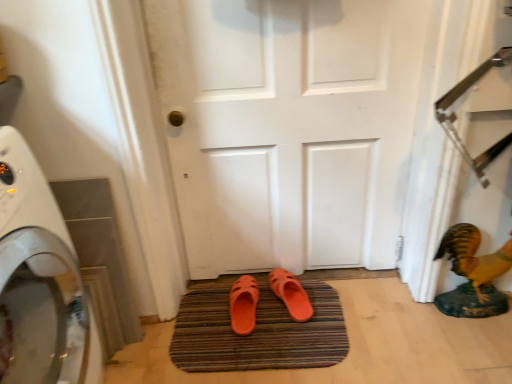
Describe the element at coordinates (243, 305) in the screenshot. I see `orange rubber slipper at center, the 1th footwear from the left` at that location.

I want to click on shiny gold statue at lower right, so [x=474, y=258].

Find the location of a particular element. The width and height of the screenshot is (512, 384). orange rubber slipper at center, the 2th footwear positioned from the left is located at coordinates (291, 294).

Is point (257, 255) closer or farther from the camera than point (504, 250)?

Point (257, 255) is positioned farther from the camera compared to point (504, 250).

Considering the positions of objects white matte door at center and shiny gold statue at lower right in the image provided, who is more to the left, white matte door at center or shiny gold statue at lower right?

From the viewer's perspective, white matte door at center appears more on the left side.

Find the location of `door in front of the shiny gold statue at lower right`. door in front of the shiny gold statue at lower right is located at coordinates (289, 127).

From a real-world perspective, is white matte door at center physically located above or below shiny gold statue at lower right?

From a real-world perspective, white matte door at center is physically above shiny gold statue at lower right.

Could you tell me if orange rubber slipper at center, the first footwear from the right, is facing orange rubber slipper at center, the 1th footwear from the left?

No.

Can you confirm if orange rubber slipper at center, the first footwear from the right, is thinner than orange rubber slipper at center, the 2th footwear from the right?

Yes, orange rubber slipper at center, the first footwear from the right, is thinner than orange rubber slipper at center, the 2th footwear from the right.

Is orange rubber slipper at center, the first footwear from the right, further to the viewer compared to orange rubber slipper at center, the 2th footwear from the right?

Yes, the depth of orange rubber slipper at center, the first footwear from the right, is greater than that of orange rubber slipper at center, the 2th footwear from the right.

From the image's perspective, is white matte door at center located above orange rubber bath mat at center?

Yes, from the image's perspective, white matte door at center is above orange rubber bath mat at center.

Does point (183, 49) come closer to viewer compared to point (186, 352)?

Yes.

Is orange rubber bath mat at center inside white matte door at center?

No.

Looking at this image, is white matte door at center beside orange rubber bath mat at center?

No, white matte door at center is not with orange rubber bath mat at center.

From the image's perspective, is orange rubber bath mat at center below white glossy washing machine at left?

Yes, from the image's perspective, orange rubber bath mat at center is beneath white glossy washing machine at left.

Which object is wider, orange rubber bath mat at center or white glossy washing machine at left?

orange rubber bath mat at center.

Considering the points (340, 354) and (58, 251), which point is in front, point (340, 354) or point (58, 251)?

The point (58, 251) is more forward.

Which is nearer, [286,277] or [26,250]?

Positioned in front is point [26,250].

How different are the orientations of orange rubber slipper at center, the 2th footwear positioned from the left, and white glossy washing machine at left in degrees?

orange rubber slipper at center, the 2th footwear positioned from the left, and white glossy washing machine at left are facing 79.4 degrees away from each other.

Is orange rubber slipper at center, the first footwear from the right, aimed at white glossy washing machine at left?

No, orange rubber slipper at center, the first footwear from the right, is not facing towards white glossy washing machine at left.

From a real-world perspective, is orange rubber slipper at center, the first footwear from the right, under white glossy washing machine at left?

Indeed, from a real-world perspective, orange rubber slipper at center, the first footwear from the right, is positioned beneath white glossy washing machine at left.

From the picture: Does white matte door at center have a lesser width compared to orange rubber slipper at center, the 2th footwear positioned from the left?

Yes, white matte door at center is thinner than orange rubber slipper at center, the 2th footwear positioned from the left.

Is white matte door at center oriented towards orange rubber slipper at center, the 2th footwear positioned from the left?

Yes, white matte door at center is facing orange rubber slipper at center, the 2th footwear positioned from the left.

Which object is positioned more to the left, white matte door at center or orange rubber slipper at center, the first footwear from the right?

Positioned to the left is white matte door at center.

Is point (24, 327) closer to viewer compared to point (239, 300)?

Yes, it is in front of point (239, 300).

Locate an element on the screen. the 2nd footwear below when counting from the white glossy washing machine at left (from the image's perspective) is located at coordinates (243, 305).

From a real-world perspective, is white glossy washing machine at left below orange rubber slipper at center, the 2th footwear from the right?

No, from a real-world perspective, white glossy washing machine at left is not beneath orange rubber slipper at center, the 2th footwear from the right.

In order to click on door above the shiny gold statue at lower right (from the image's perspective) in this screenshot , I will do `click(289, 127)`.

Find the location of a particular element. Image resolution: width=512 pixels, height=384 pixels. footwear on the right of orange rubber slipper at center, the 1th footwear from the left is located at coordinates (291, 294).

Based on their spatial positions, is shiny gold statue at lower right or orange rubber slipper at center, the 1th footwear from the left, closer to white matte door at center?

Based on the image, shiny gold statue at lower right appears to be nearer to white matte door at center.

Considering their positions, is orange rubber slipper at center, the first footwear from the right, positioned closer to orange rubber bath mat at center than white glossy washing machine at left?

orange rubber slipper at center, the first footwear from the right, is closer to orange rubber bath mat at center.

Looking at the image, which one is located further to shiny gold statue at lower right, orange rubber slipper at center, the first footwear from the right, or orange rubber slipper at center, the 2th footwear from the right?

Among the two, orange rubber slipper at center, the 2th footwear from the right, is located further to shiny gold statue at lower right.

From the image, which object appears to be farther from shiny gold statue at lower right, white glossy washing machine at left or orange rubber slipper at center, the 2th footwear positioned from the left?

white glossy washing machine at left is positioned further to the anchor shiny gold statue at lower right.

Considering their positions, is shiny gold statue at lower right positioned closer to orange rubber bath mat at center than orange rubber slipper at center, the 2th footwear positioned from the left?

orange rubber slipper at center, the 2th footwear positioned from the left, is positioned closer to the anchor orange rubber bath mat at center.

Looking at the image, which one is located further to white matte door at center, orange rubber slipper at center, the 1th footwear from the left, or white glossy washing machine at left?

white glossy washing machine at left is further to white matte door at center.

Looking at the image, which one is located further to white glossy washing machine at left, orange rubber slipper at center, the 1th footwear from the left, or orange rubber bath mat at center?

Among the two, orange rubber slipper at center, the 1th footwear from the left, is located further to white glossy washing machine at left.

Based on their spatial positions, is shiny gold statue at lower right or orange rubber bath mat at center further from white matte door at center?

The object further to white matte door at center is shiny gold statue at lower right.

Locate an element on the screen. bath mat between white glossy washing machine at left and orange rubber slipper at center, the 2th footwear positioned from the left, from front to back is located at coordinates coord(257,330).

At what (x,y) coordinates should I click in order to perform the action: click on bath mat situated between white glossy washing machine at left and shiny gold statue at lower right from left to right. Please return your answer as a coordinate pair (x, y). This screenshot has width=512, height=384. Looking at the image, I should click on (257, 330).

Image resolution: width=512 pixels, height=384 pixels. Identify the location of door between orange rubber slipper at center, the 1th footwear from the left, and shiny gold statue at lower right from left to right. (289, 127).

Where is `footwear located between white glossy washing machine at left and orange rubber slipper at center, the 2th footwear positioned from the left, in the depth direction`? The image size is (512, 384). footwear located between white glossy washing machine at left and orange rubber slipper at center, the 2th footwear positioned from the left, in the depth direction is located at coordinates (243, 305).